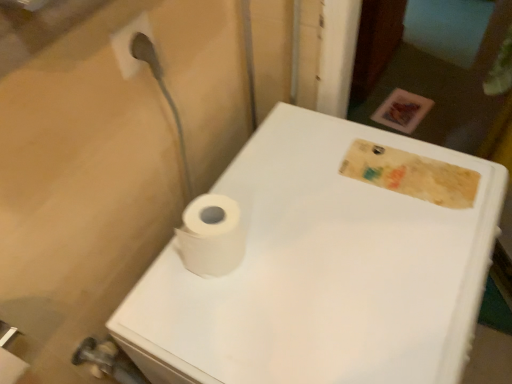
Locate an element on the screen. vacant space to the right of white matte toilet paper at center is located at coordinates (314, 249).